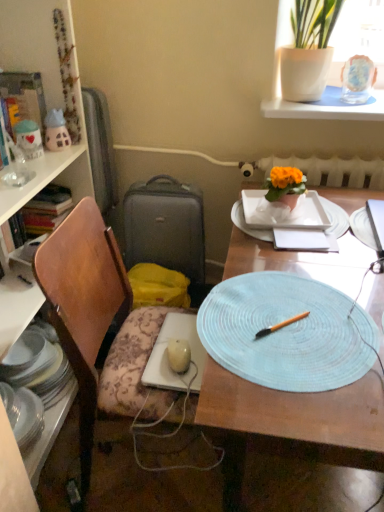
Describe the element at coordinates (23, 414) in the screenshot. I see `white glossy plate at left, the 1th plate in the left-to-right sequence` at that location.

You are a GUI agent. You are given a task and a screenshot of the screen. Output one action in this format:
    pyautogui.click(x=<x>, y=<y>)
    Task: Click on the wooden bookcase at left
    The height and width of the screenshot is (512, 384).
    Given the screenshot: What is the action you would take?
    pyautogui.click(x=44, y=94)

Locate an element on the screen. The width and height of the screenshot is (384, 512). white ceramic vase at upper right is located at coordinates (327, 106).

Describe the element at coordinates (363, 228) in the screenshot. I see `light blue textured placemat at right, marked as the 1th platter in a back-to-front arrangement` at that location.

This screenshot has height=512, width=384. What do you see at coordinates (83, 303) in the screenshot? I see `wooden chair at left` at bounding box center [83, 303].

In order to click on white ceramic plate at center, which is the 2th plate from bottom to top in this screenshot , I will do `click(335, 218)`.

Considering the relative sizes of white glossy plate at left, which appears as the 1th plate when ordered from the bottom, and light blue woven placemat at center in the image provided, is white glossy plate at left, which appears as the 1th plate when ordered from the bottom, shorter than light blue woven placemat at center?

Yes.

Are white glossy plate at left, arranged as the 2th plate when viewed from the top, and light blue woven placemat at center located far from each other?

That's not correct — white glossy plate at left, arranged as the 2th plate when viewed from the top, is a little close to light blue woven placemat at center.

Which is more to the left, white glossy plate at left, the 1th plate in the left-to-right sequence, or light blue woven placemat at center?

From the viewer's perspective, white glossy plate at left, the 1th plate in the left-to-right sequence, appears more on the left side.

How far apart are orange matte flower pot at upper right and white ceramic vase at upper right?

They are 14.94 inches apart.

From a real-world perspective, relative to white ceramic vase at upper right, is orange matte flower pot at upper right vertically above or below?

From a real-world perspective, orange matte flower pot at upper right is physically below white ceramic vase at upper right.

Can white ceramic vase at upper right be found inside orange matte flower pot at upper right?

No, white ceramic vase at upper right is not inside orange matte flower pot at upper right.

From the image's perspective, which one is positioned higher, orange matte flower pot at upper right or white ceramic vase at upper right?

white ceramic vase at upper right appears higher in the image.

Does light blue textured placemat at right, placed as the second platter when sorted from front to back, touch wooden bookcase at left?

No, light blue textured placemat at right, placed as the second platter when sorted from front to back, is not next to wooden bookcase at left.

Is light blue textured placemat at right, which is counted as the 1th platter, starting from the top, thinner than wooden bookcase at left?

Yes.

From the image's perspective, which is below, light blue textured placemat at right, the 2th platter in the bottom-to-top sequence, or wooden bookcase at left?

From the image's view, wooden bookcase at left is below.

Is wooden bookcase at left at the back of light blue textured placemat at right, the 2th platter in the bottom-to-top sequence?

No, light blue textured placemat at right, the 2th platter in the bottom-to-top sequence, is not facing away from wooden bookcase at left.

From the image's perspective, would you say light blue woven placemat at center, the 1th platter positioned from the front, is shown under light blue textured placemat at right, which is counted as the 1th platter, starting from the top?

Indeed, from the image's perspective, light blue woven placemat at center, the 1th platter positioned from the front, is shown beneath light blue textured placemat at right, which is counted as the 1th platter, starting from the top.

In the scene shown: Is light blue woven placemat at center, which is the second platter in back-to-front order, placed right next to light blue textured placemat at right, which is counted as the 1th platter, starting from the top?

No.

Measure the distance between light blue woven placemat at center, which is the second platter in back-to-front order, and light blue textured placemat at right, arranged as the second platter when viewed from the left.

17.68 inches.

Which of these two, light blue woven placemat at center, marked as the 2th platter in a top-to-bottom arrangement, or light blue textured placemat at right, placed as the second platter when sorted from front to back, is smaller?

light blue woven placemat at center, marked as the 2th platter in a top-to-bottom arrangement.

Considering the relative positions of light blue woven placemat at center and wooden chair at left in the image provided, is light blue woven placemat at center to the right of wooden chair at left from the viewer's perspective?

Yes.

What's the angular difference between light blue woven placemat at center and wooden chair at left's facing directions?

There is a 0.437-degree angle between the facing directions of light blue woven placemat at center and wooden chair at left.

Does point (363, 301) come closer to viewer compared to point (54, 281)?

No, it is behind (54, 281).

Would you say light blue woven placemat at center is inside or outside wooden chair at left?

light blue woven placemat at center is not enclosed by wooden chair at left.

Is wooden bookcase at left located outside wooden chair at left?

Absolutely, wooden bookcase at left is external to wooden chair at left.

Which object is positioned more to the right, wooden bookcase at left or wooden chair at left?

Positioned to the right is wooden chair at left.

Would you consider wooden bookcase at left to be distant from wooden chair at left?

No, wooden bookcase at left is in close proximity to wooden chair at left.

Consider the image. Who is smaller, wooden bookcase at left or wooden chair at left?

wooden chair at left.

Can you confirm if white ceramic plate at center, the first plate in the right-to-left sequence, is taller than white glossy plate at left, arranged as the 2th plate when viewed from the top?

No.

Which is closer to the camera, (x=244, y=230) or (x=21, y=430)?

Positioned in front is point (x=21, y=430).

Is white ceramic plate at center, the first plate from the top, not within white glossy plate at left, arranged as the 2th plate when viewed from the top?

white ceramic plate at center, the first plate from the top, lies outside white glossy plate at left, arranged as the 2th plate when viewed from the top,'s area.

Is white ceramic plate at center, which is the 2th plate in left-to-right order, in front of or behind white glossy plate at left, the second plate when ordered from right to left, in the image?

white ceramic plate at center, which is the 2th plate in left-to-right order, is positioned closer to the viewer than white glossy plate at left, the second plate when ordered from right to left.

At what (x,y) coordinates should I click in order to perform the action: click on the 2nd plate counting from the left side of the light blue woven placemat at center. Please return your answer as a coordinate pair (x, y). The image size is (384, 512). Looking at the image, I should click on (23, 414).

You are a GUI agent. You are given a task and a screenshot of the screen. Output one action in this format:
    pyautogui.click(x=<x>, y=<y>)
    Task: Click on the houseplant below the white ceramic vase at upper right (from the image's perspective)
    
    Given the screenshot: What is the action you would take?
    pyautogui.click(x=285, y=185)

Which object lies further to the anchor point white glossy plate at left, the 1th plate in the left-to-right sequence, light blue woven placemat at center or white ceramic vase at upper right?

Based on the image, white ceramic vase at upper right appears to be further to white glossy plate at left, the 1th plate in the left-to-right sequence.

Estimate the real-world distances between objects in this image. Which object is closer to matte gray suitcase at left, wooden bookcase at left or white ceramic plate at center, which is the 2th plate from bottom to top?

Among the two, wooden bookcase at left is located nearer to matte gray suitcase at left.

Consider the image. Which object lies nearer to the anchor point wooden bookcase at left, white glossy plate at left, which appears as the 1th plate when ordered from the bottom, or wooden chair at left?

wooden chair at left lies closer to wooden bookcase at left than the other object.

Based on their spatial positions, is light blue woven placemat at center or orange matte flower pot at upper right further from wooden chair at left?

Among the two, orange matte flower pot at upper right is located further to wooden chair at left.

Estimate the real-world distances between objects in this image. Which object is further from white ceramic vase at upper right, light blue woven placemat at center or wooden bookcase at left?

The object further to white ceramic vase at upper right is wooden bookcase at left.

Which object lies nearer to the anchor point light blue woven placemat at center, the 1th platter positioned from the front, orange matte flower pot at upper right or white glossy plate at left, the 1th plate in the left-to-right sequence?

Based on the image, orange matte flower pot at upper right appears to be nearer to light blue woven placemat at center, the 1th platter positioned from the front.

When comparing their distances from light blue textured placemat at right, the 2th platter in the bottom-to-top sequence, does orange matte flower pot at upper right or wooden chair at left seem closer?

orange matte flower pot at upper right lies closer to light blue textured placemat at right, the 2th platter in the bottom-to-top sequence, than the other object.

Estimate the real-world distances between objects in this image. Which object is closer to light blue textured placemat at right, which is counted as the 1th platter, starting from the top, light blue woven placemat at center, which is the second platter in back-to-front order, or wooden bookcase at left?

Based on the image, light blue woven placemat at center, which is the second platter in back-to-front order, appears to be nearer to light blue textured placemat at right, which is counted as the 1th platter, starting from the top.

Locate an element on the screen. window sill between light blue woven placemat at center, marked as the 2th platter in a top-to-bottom arrangement, and matte gray suitcase at left, along the z-axis is located at coordinates (327, 106).

Where is `plate situated between wooden bookcase at left and wooden chair at left from left to right`? This screenshot has width=384, height=512. plate situated between wooden bookcase at left and wooden chair at left from left to right is located at coordinates (23, 414).

You are a GUI agent. You are given a task and a screenshot of the screen. Output one action in this format:
    pyautogui.click(x=<x>, y=<y>)
    Task: Click on the platter between wooden bookcase at left and white ceramic vase at upper right from left to right
    The height and width of the screenshot is (512, 384).
    Given the screenshot: What is the action you would take?
    pyautogui.click(x=283, y=333)

Find the location of a particular element. desk situated between stacked glass plates at left and light blue textured placemat at right, the 2th platter in the bottom-to-top sequence, from left to right is located at coordinates (290, 424).